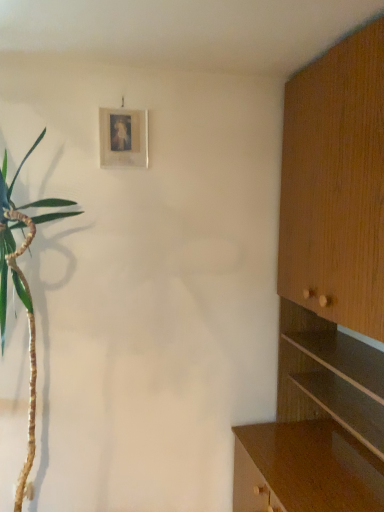
Question: Is matte wooden picture frame at upper center turned away from wooden cabinet at right?

Choices:
 (A) no
 (B) yes

Answer: (A)

Question: From a real-world perspective, is matte wooden picture frame at upper center on wooden cabinet at right?

Choices:
 (A) yes
 (B) no

Answer: (A)

Question: Can you confirm if matte wooden picture frame at upper center is smaller than wooden cabinet at right?

Choices:
 (A) no
 (B) yes

Answer: (B)

Question: Is matte wooden picture frame at upper center further to camera compared to wooden cabinet at right?

Choices:
 (A) no
 (B) yes

Answer: (B)

Question: Considering the relative positions of matte wooden picture frame at upper center and wooden cabinet at right in the image provided, is matte wooden picture frame at upper center in front of wooden cabinet at right?

Choices:
 (A) no
 (B) yes

Answer: (A)

Question: Can you confirm if matte wooden picture frame at upper center is thinner than wooden cabinet at right?

Choices:
 (A) yes
 (B) no

Answer: (A)

Question: Is wooden cabinet at right touching matte wooden picture frame at upper center?

Choices:
 (A) yes
 (B) no

Answer: (B)

Question: Does wooden cabinet at right have a lesser width compared to matte wooden picture frame at upper center?

Choices:
 (A) no
 (B) yes

Answer: (A)

Question: Considering the relative positions of wooden cabinet at right and matte wooden picture frame at upper center in the image provided, is wooden cabinet at right behind matte wooden picture frame at upper center?

Choices:
 (A) no
 (B) yes

Answer: (A)

Question: From a real-world perspective, is wooden cabinet at right on matte wooden picture frame at upper center?

Choices:
 (A) yes
 (B) no

Answer: (B)

Question: Would you say wooden cabinet at right is a long distance from matte wooden picture frame at upper center?

Choices:
 (A) no
 (B) yes

Answer: (B)

Question: Does wooden cabinet at right have a lesser height compared to matte wooden picture frame at upper center?

Choices:
 (A) no
 (B) yes

Answer: (A)

Question: Is matte wooden picture frame at upper center taller or shorter than wooden cabinet at right?

Choices:
 (A) tall
 (B) short

Answer: (B)